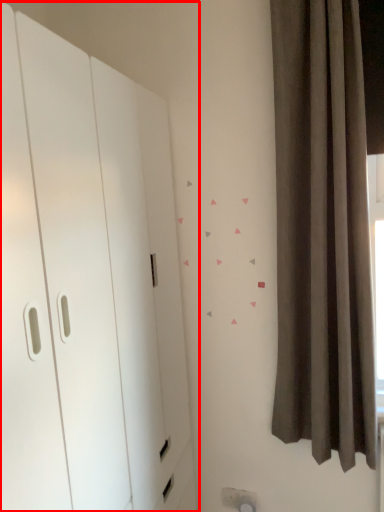
Question: Considering the relative positions of dresser (annotated by the red box) and curtain in the image provided, where is dresser (annotated by the red box) located with respect to the staircase?

Choices:
 (A) right
 (B) left

Answer: (B)